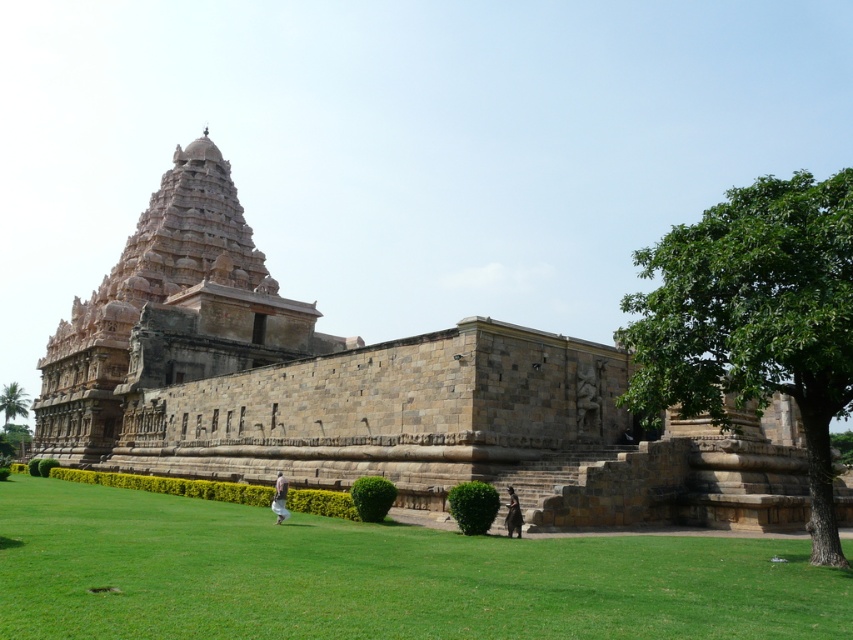
You are a visitor standing at the entrance of the temple complex. You want to find a spot to sit and rest. The green grass at lower center and the green leafy tree at right are both nearby. Which location would provide shade from the sun if the tree is casting a shadow?

The green grass at lower center is positioned under green leafy tree at right, so sitting there would place you in the shade cast by the tree.

You are a visitor standing at the entrance of the temple complex. You want to take a photo of the stone carved temple at center with the green grass at lower center in the foreground. Based on their positions, which object should be placed closer to the camera to ensure both are in focus?

The green grass at lower center is to the right of the stone carved temple at center. To have both in focus, the stone carved temple at center should be closer to the camera since it is the main subject and the grass is in the foreground.